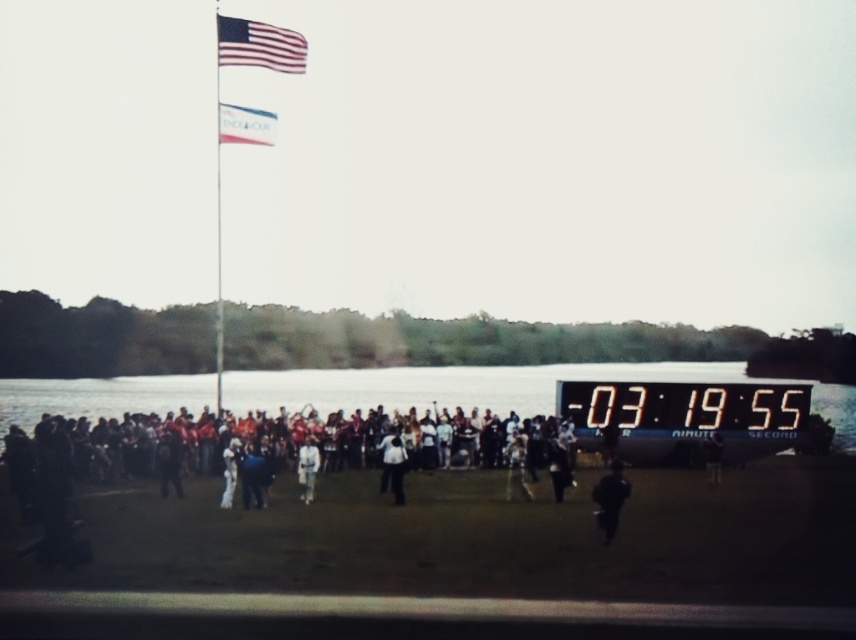
You are a photographer at the event and need to capture a photo that includes both the clear water at lower center and the white fabric person at center. Based on their relative heights, which object should be placed lower in the frame to ensure both are visible?

The clear water at lower center is taller than the white fabric person at center, so to ensure both are visible, the white fabric person at center should be placed lower in the frame since it is shorter.

You are a photographer trying to capture a clear shot of the black matte person at lower right without the dark clothing crowd at center blocking the view. Based on their positions, can you position yourself in a way to avoid the crowd?

The dark clothing crowd at center is closer to the viewer than the black matte person at lower right, so you would need to move your position to either side or behind the crowd to get an unobstructed view of the black matte person at lower right.

Consider the image. You are a spectator at the sporting event and need to quickly move from the metallic flag pole at upper left to the white fabric flag at upper center. Given that the distance between them is 128.19 feet, can you estimate how many seconds it would take you to walk this distance at a normal pace?

Walking at a normal pace of about 3 feet per second, the metallic flag pole at upper left and white fabric flag at upper center are 128.19 feet apart, so it would take approximately 42.7 seconds to walk between them.